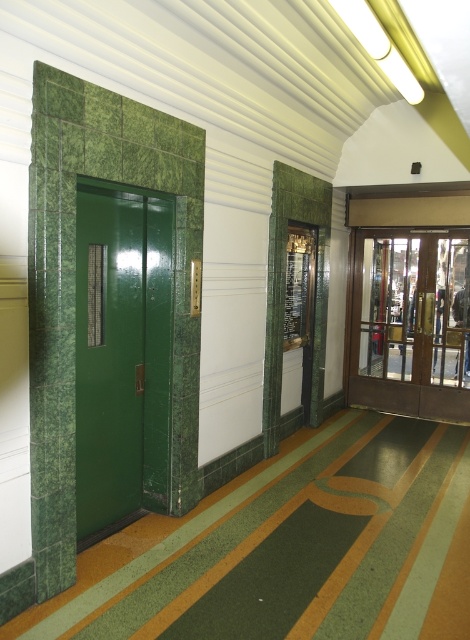
You are moving a large piece of furniture that is 2 meters wide. You need to pass through either the green glossy elevator at left or the green polished wood elevator at center. Which elevator should you choose to ensure the furniture fits?

The green polished wood elevator at center is larger than the green glossy elevator at left, so you should choose the green polished wood elevator at center to ensure the furniture fits.

You are a delivery person carrying a package that requires a 4 meter wide path to maneuver. You are in the hallway and see the green glossy elevator at left and the green polished wood elevator at center. Can you safely navigate through the space between them with your package?

The distance between the green glossy elevator at left and the green polished wood elevator at center is 3.95 meters, which is slightly less than the required 4 meters. Therefore, it might be risky to navigate through the space between them with your package as there is insufficient clearance.